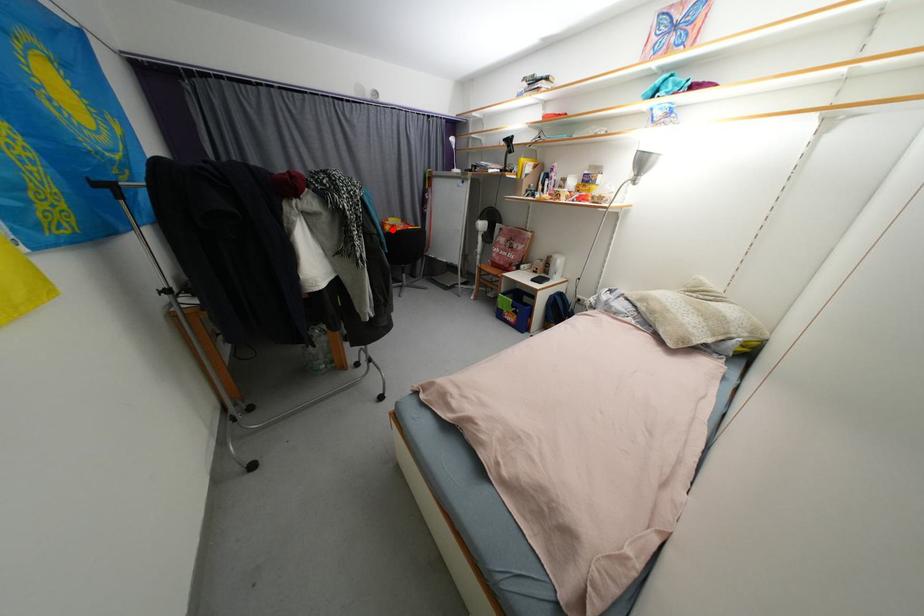
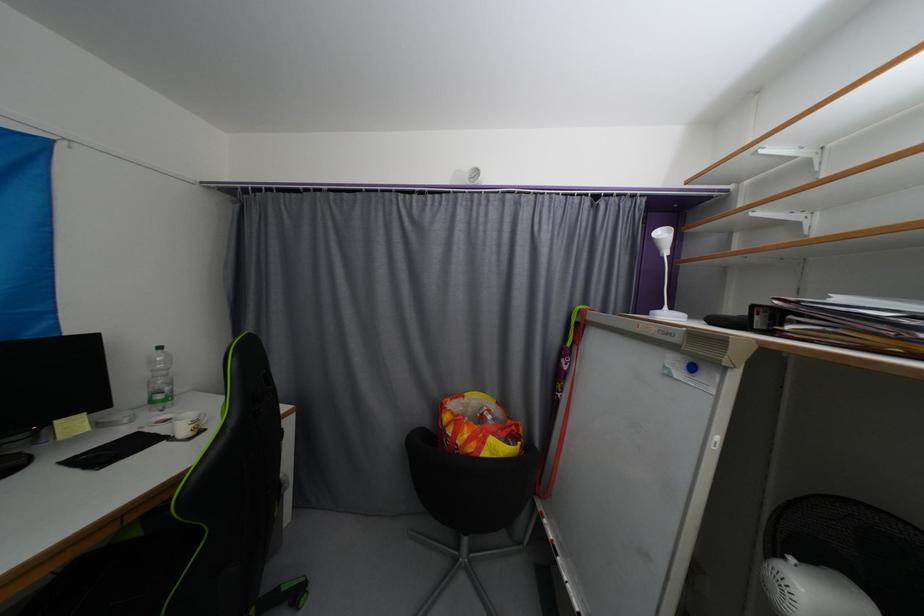
Find the pixel in the second image that matches the highlighted location in the first image.

(452, 419)